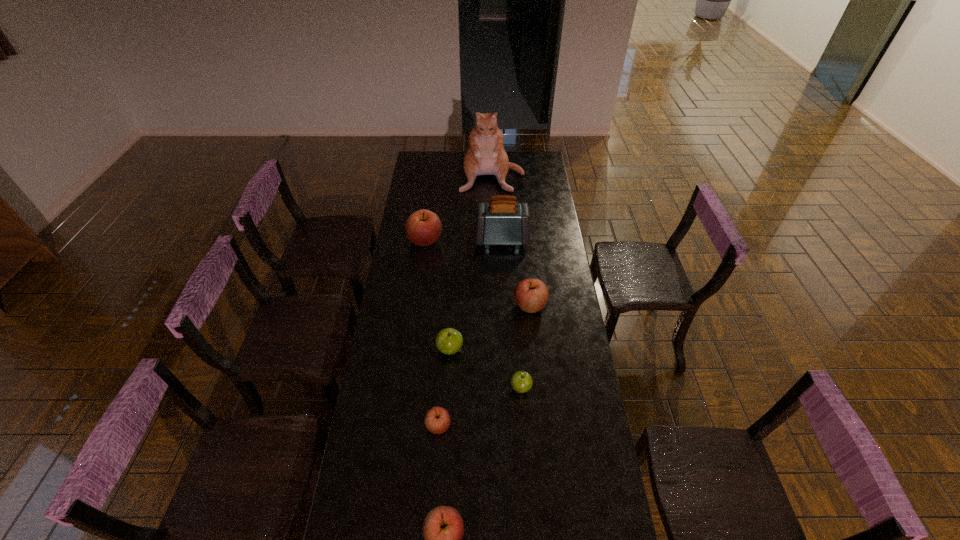
The height and width of the screenshot is (540, 960). What are the coordinates of `cat` in the screenshot? It's located at (485, 156).

Identify the location of orange cat. (485, 156).

Find the location of a particular element. the second tallest object is located at coordinates (502, 221).

Image resolution: width=960 pixels, height=540 pixels. I want to click on the biggest red apple, so click(x=423, y=227).

Image resolution: width=960 pixels, height=540 pixels. In order to click on the farthest red apple in this screenshot , I will do `click(423, 227)`.

This screenshot has width=960, height=540. Find the location of `the fifth shortest object`. the fifth shortest object is located at coordinates (531, 295).

The image size is (960, 540). What are the coordinates of `the fourth farthest object` in the screenshot? It's located at (531, 295).

You are a GUI agent. You are given a task and a screenshot of the screen. Output one action in this format:
    pyautogui.click(x=<x>, y=<y>)
    Task: Click on the left green apple
    The width and height of the screenshot is (960, 540).
    Given the screenshot: What is the action you would take?
    pyautogui.click(x=448, y=341)

Where is `the fourth nearest apple`? The height and width of the screenshot is (540, 960). the fourth nearest apple is located at coordinates (448, 341).

This screenshot has height=540, width=960. I want to click on the third nearest apple, so click(x=521, y=381).